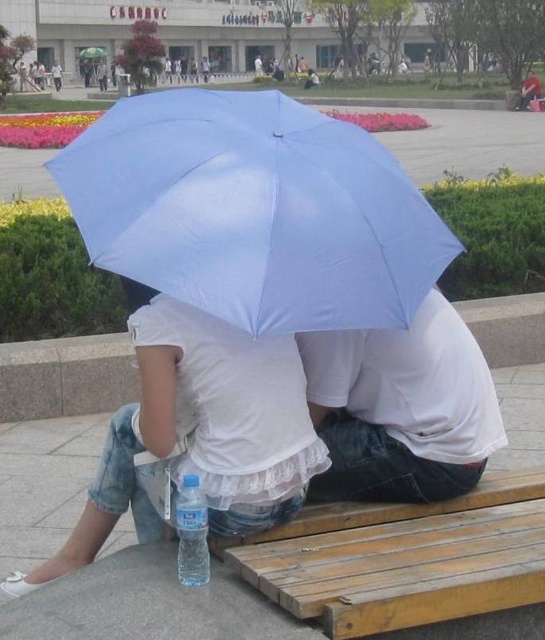
Does light blue fabric umbrella at center lie behind white matte shirt at center?

No, light blue fabric umbrella at center is closer to the viewer.

Between point (284, 230) and point (382, 486), which one is positioned behind?

The point (382, 486) is more distant.

Who is more distant from viewer, (x=293, y=118) or (x=376, y=346)?

Point (x=293, y=118)

Find the location of a particular element. light blue fabric umbrella at center is located at coordinates (253, 211).

The image size is (545, 640). Describe the element at coordinates (253, 211) in the screenshot. I see `light blue fabric umbrella at center` at that location.

Based on the photo, does light blue fabric umbrella at center have a lesser height compared to wooden bench at lower center?

No.

Does point (142, 188) come farther from viewer compared to point (415, 616)?

Yes, point (142, 188) is farther from viewer.

You are a GUI agent. You are given a task and a screenshot of the screen. Output one action in this format:
    pyautogui.click(x=<x>, y=<y>)
    Task: Click on the light blue fabric umbrella at center
    This screenshot has height=640, width=545.
    Given the screenshot: What is the action you would take?
    pyautogui.click(x=253, y=211)

Which is below, white matte shirt at center or clear plastic bottle at lower center?

clear plastic bottle at lower center

Does white matte shirt at center have a lesser width compared to clear plastic bottle at lower center?

Incorrect, white matte shirt at center's width is not less than clear plastic bottle at lower center's.

Image resolution: width=545 pixels, height=640 pixels. I want to click on white matte shirt at center, so click(x=402, y=408).